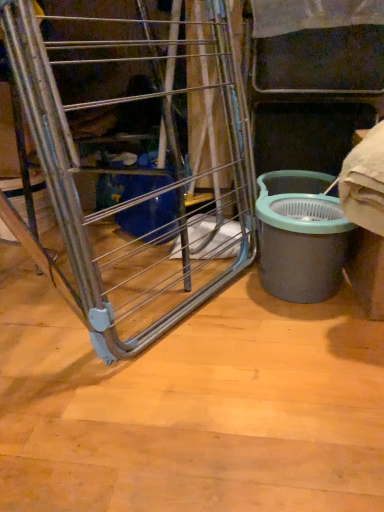
Question: Should I look upward or downward to see metallic silver ladder at center?

Choices:
 (A) down
 (B) up

Answer: (B)

Question: Does metallic silver ladder at center have a smaller size compared to matte gray bucket at right?

Choices:
 (A) yes
 (B) no

Answer: (B)

Question: Is metallic silver ladder at center closer to camera compared to matte gray bucket at right?

Choices:
 (A) no
 (B) yes

Answer: (B)

Question: Can you confirm if metallic silver ladder at center is wider than matte gray bucket at right?

Choices:
 (A) yes
 (B) no

Answer: (B)

Question: Considering the relative sizes of metallic silver ladder at center and matte gray bucket at right in the image provided, is metallic silver ladder at center shorter than matte gray bucket at right?

Choices:
 (A) no
 (B) yes

Answer: (A)

Question: Can you confirm if metallic silver ladder at center is taller than matte gray bucket at right?

Choices:
 (A) yes
 (B) no

Answer: (A)

Question: Would you say matte gray bucket at right is part of metallic silver ladder at center's contents?

Choices:
 (A) yes
 (B) no

Answer: (B)

Question: From a real-world perspective, is matte gray bucket at right beneath metallic silver ladder at center?

Choices:
 (A) yes
 (B) no

Answer: (A)

Question: Is matte gray bucket at right not within metallic silver ladder at center?

Choices:
 (A) no
 (B) yes

Answer: (B)

Question: Does matte gray bucket at right lie in front of metallic silver ladder at center?

Choices:
 (A) no
 (B) yes

Answer: (A)

Question: Is matte gray bucket at right facing towards metallic silver ladder at center?

Choices:
 (A) yes
 (B) no

Answer: (B)

Question: Are matte gray bucket at right and metallic silver ladder at center making contact?

Choices:
 (A) no
 (B) yes

Answer: (A)

Question: Is matte gray bucket at right thinner than metallic silver ladder at center?

Choices:
 (A) no
 (B) yes

Answer: (A)

Question: Does point (66, 300) appear closer or farther from the camera than point (299, 230)?

Choices:
 (A) farther
 (B) closer

Answer: (A)